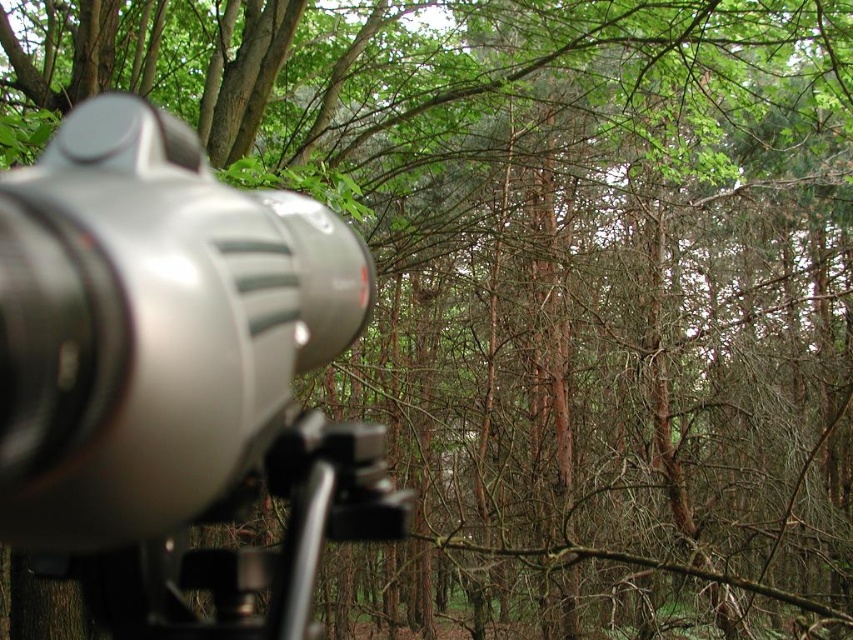
You are a photographer trying to capture a wide shot of the forest. You have a camera at point (151, 326). Can you tell me what is the position of the camera relative to the tripod?

The camera at point (151, 326) is positioned to the left of the tripod.

You are a photographer setting up equipment in a forest. You have a satin silver camera at left and a satin black tripod at lower left. Which object is narrower?

The satin silver camera at left is narrower than the satin black tripod at lower left.

You are a photographer trying to set up your equipment in the forest. You have a satin silver camera at left. Based on its position, can you determine if it is centered horizontally in the frame?

The satin silver camera at left is positioned at point 0.511 on the horizontal axis, which is very close to the center of the frame. Therefore, it is nearly centered horizontally.